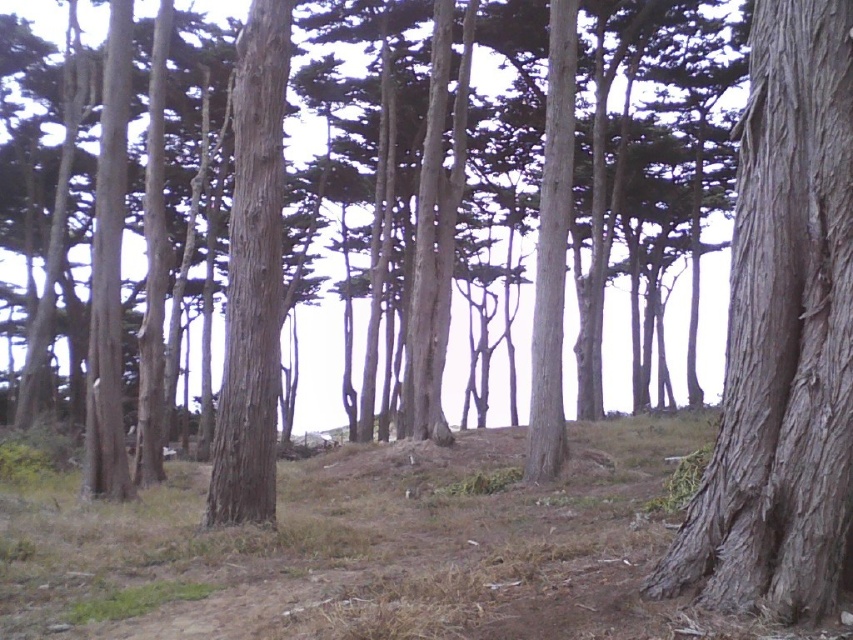
You are a hiker who wants to mark the tallest tree in the forest. Which one should you choose between the smooth bark tree at center and the smooth brown tree trunk at center?

The smooth bark tree at center has a larger size compared to the smooth brown tree trunk at center, so you should mark the smooth bark tree at center as the tallest tree.

You are standing in the middle of the forest and see two tree trunks in front of you. The first is a gray rough bark tree trunk at center, and the second is a smooth bark tree at center. Which tree trunk is positioned more to the right?

The gray rough bark tree trunk at center is positioned more to the right compared to the smooth bark tree at center.